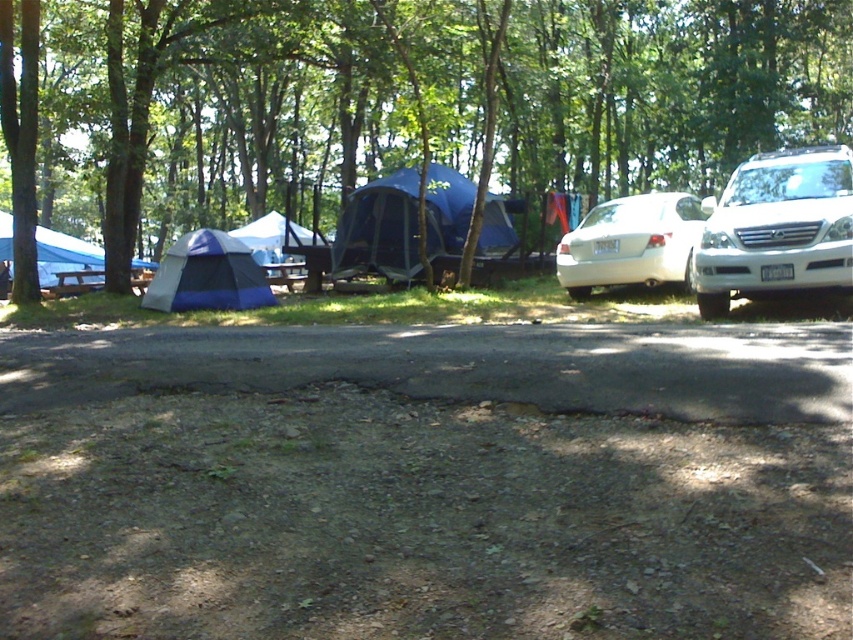
Question: Which of the following is the closest to the observer?

Choices:
 (A) green leafy tree at upper center
 (B) blue fabric picnic table at left
 (C) blue mesh tent at center
 (D) blue/gray fabric tent at left

Answer: (A)

Question: Which of the following is the farthest from the observer?

Choices:
 (A) white glossy sedan at right
 (B) blue mesh tent at center
 (C) blue fabric tent at center

Answer: (C)

Question: In this image, where is green leafy tree at upper center located relative to white glossy suv at right?

Choices:
 (A) right
 (B) left

Answer: (B)

Question: Is green leafy tree at upper center in front of white glossy suv at right?

Choices:
 (A) no
 (B) yes

Answer: (A)

Question: Estimate the real-world distances between objects in this image. Which object is farther from the blue/gray fabric tent at left?

Choices:
 (A) white glossy sedan at right
 (B) blue mesh tent at center

Answer: (A)

Question: Is blue/gray fabric tent at left bigger than blue fabric picnic table at left?

Choices:
 (A) no
 (B) yes

Answer: (B)